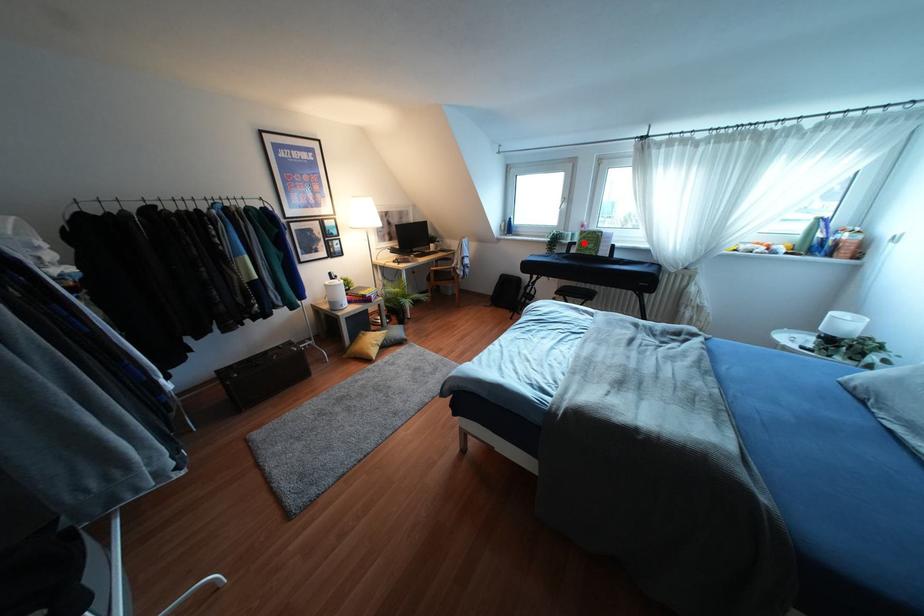
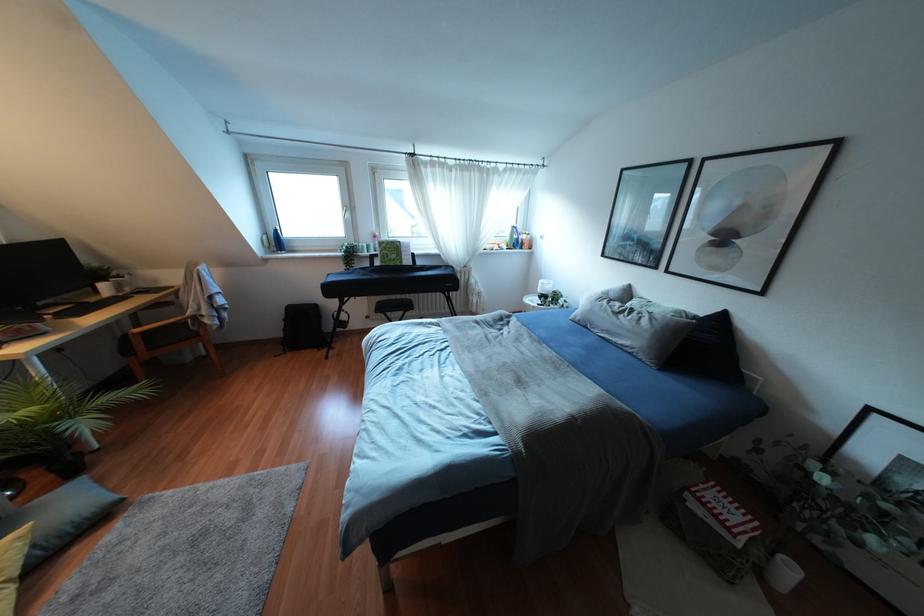
In the second image, find the point that corresponds to the highlighted location in the first image.

(385, 254)